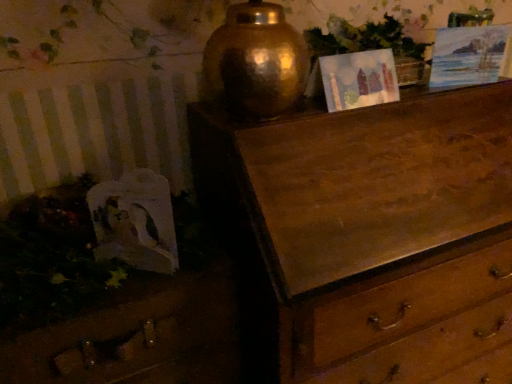
Question: Is green leafy plant at upper center in front of or behind matte paper picture frame at upper center, which is counted as the first picture frame, starting from the left, in the image?

Choices:
 (A) front
 (B) behind

Answer: (B)

Question: Is point (408, 49) positioned closer to the camera than point (393, 89)?

Choices:
 (A) closer
 (B) farther

Answer: (B)

Question: Estimate the real-world distances between objects in this image. Which object is closer to the watercolor paper picture frame at upper right, placed as the first picture frame when sorted from right to left?

Choices:
 (A) matte paper picture frame at upper center, which is counted as the first picture frame, starting from the left
 (B) wooden drawer at lower left
 (C) green leafy plant at upper center

Answer: (C)

Question: Which object is positioned farthest from the matte paper picture frame at upper center, the 2th picture frame in the right-to-left sequence?

Choices:
 (A) watercolor paper picture frame at upper right, acting as the 2th picture frame starting from the left
 (B) green leafy plant at upper center
 (C) wooden drawer at lower left

Answer: (C)